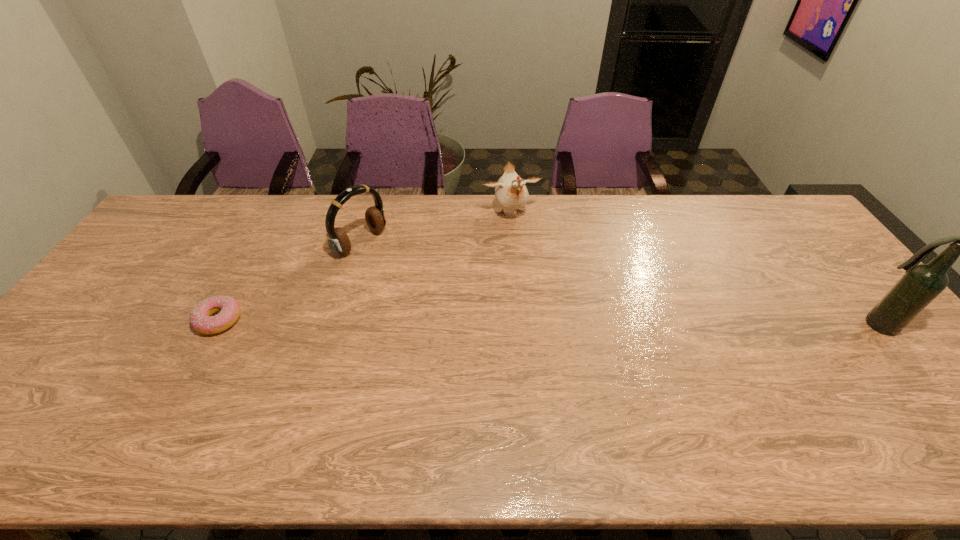
Find the location of a particular element. This screenshot has height=540, width=960. free space between the shortest object and the rightmost object is located at coordinates (548, 323).

This screenshot has width=960, height=540. I want to click on free space that is in between the second object from right to left and the headset, so click(436, 228).

The width and height of the screenshot is (960, 540). In order to click on vacant area that lies between the second object from left to right and the rightmost object in this screenshot , I will do `click(619, 284)`.

Where is `object that is the second closest to the tallest object`? The image size is (960, 540). object that is the second closest to the tallest object is located at coordinates (338, 241).

Identify the location of object that is the second closest to the tallest object. (338, 241).

Locate an element on the screen. vacant region that satisfies the following two spatial constraints: 1. on the front side of the beer bottle; 2. on the right side of the second object from left to right is located at coordinates (337, 325).

Locate an element on the screen. The height and width of the screenshot is (540, 960). blank area in the image that satisfies the following two spatial constraints: 1. on the front side of the third object from left to right; 2. on the right side of the rightmost object is located at coordinates (519, 325).

You are a GUI agent. You are given a task and a screenshot of the screen. Output one action in this format:
    pyautogui.click(x=<x>, y=<y>)
    Task: Click on the vacant region that satisfies the following two spatial constraints: 1. on the back side of the headset; 2. on the right side of the shortest object
    The height and width of the screenshot is (540, 960).
    Given the screenshot: What is the action you would take?
    261,242

At what (x,y) coordinates should I click in order to perform the action: click on vacant position in the image that satisfies the following two spatial constraints: 1. on the back side of the doughnut; 2. on the right side of the headset. Please return your answer as a coordinate pair (x, y). The width and height of the screenshot is (960, 540). Looking at the image, I should click on click(x=261, y=242).